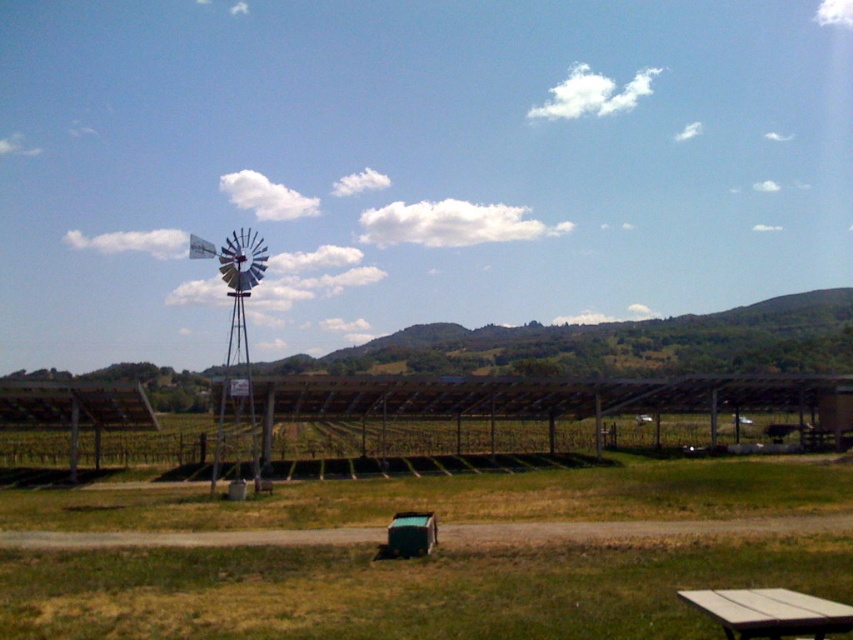
Question: Is white plastic windmill at left thinner than wooden picnic table at lower right?

Choices:
 (A) yes
 (B) no

Answer: (B)

Question: In this image, where is white plastic windmill at left located relative to wooden picnic table at lower right?

Choices:
 (A) right
 (B) left

Answer: (B)

Question: Among these objects, which one is farthest from the camera?

Choices:
 (A) wooden picnic table at lower right
 (B) white plastic windmill at left

Answer: (B)

Question: Is white plastic windmill at left above wooden picnic table at lower right?

Choices:
 (A) yes
 (B) no

Answer: (A)